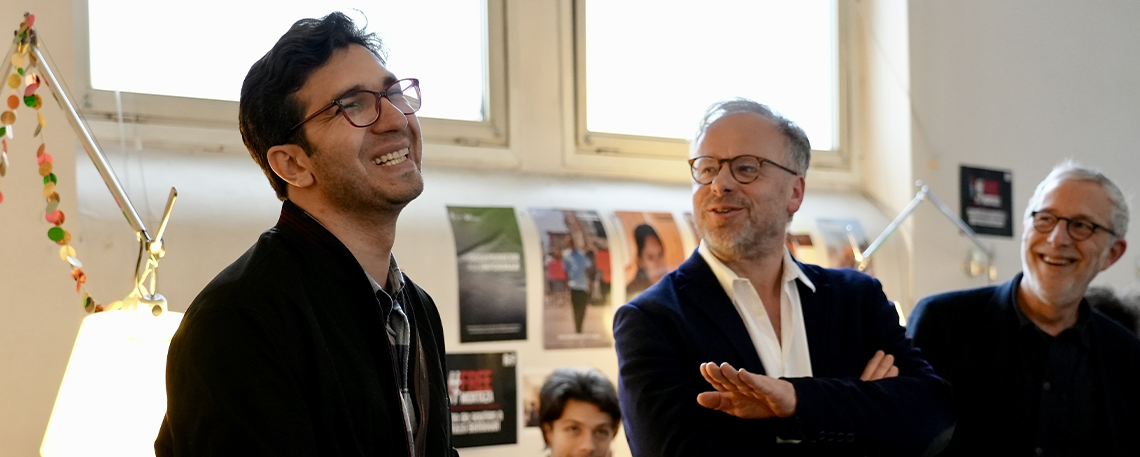
In order to click on window in this screenshot , I will do `click(636, 22)`.